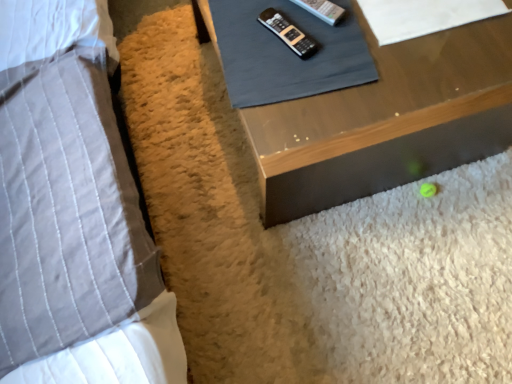
Where is `vacant area in front of black plastic remote at upper center`? vacant area in front of black plastic remote at upper center is located at coordinates (294, 86).